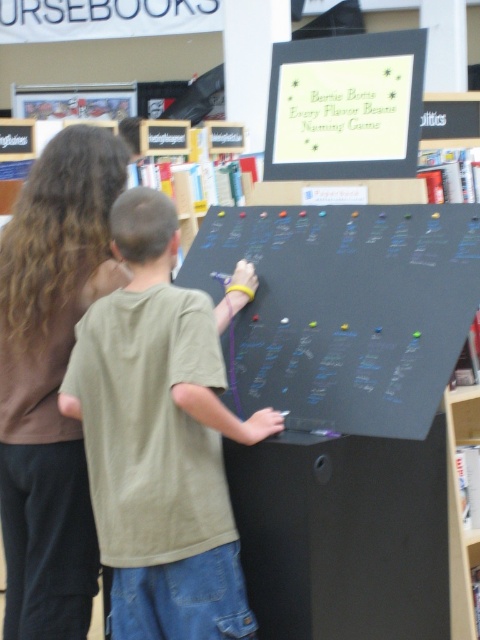
Question: Is black chalkboard at center to the right of matte black board at upper center from the viewer's perspective?

Choices:
 (A) yes
 (B) no

Answer: (B)

Question: Does green cotton shirt at center have a lesser width compared to black chalkboard at center?

Choices:
 (A) yes
 (B) no

Answer: (A)

Question: Among these points, which one is nearest to the camera?

Choices:
 (A) (232, 536)
 (B) (298, 282)

Answer: (A)

Question: Which of the following is the farthest from the observer?

Choices:
 (A) green cotton shirt at center
 (B) black chalkboard at center

Answer: (B)

Question: Among these points, which one is nearest to the camera?

Choices:
 (A) (216, 372)
 (B) (339, 280)
 (C) (410, 49)

Answer: (A)

Question: Is green cotton shirt at center bigger than black chalkboard at center?

Choices:
 (A) no
 (B) yes

Answer: (A)